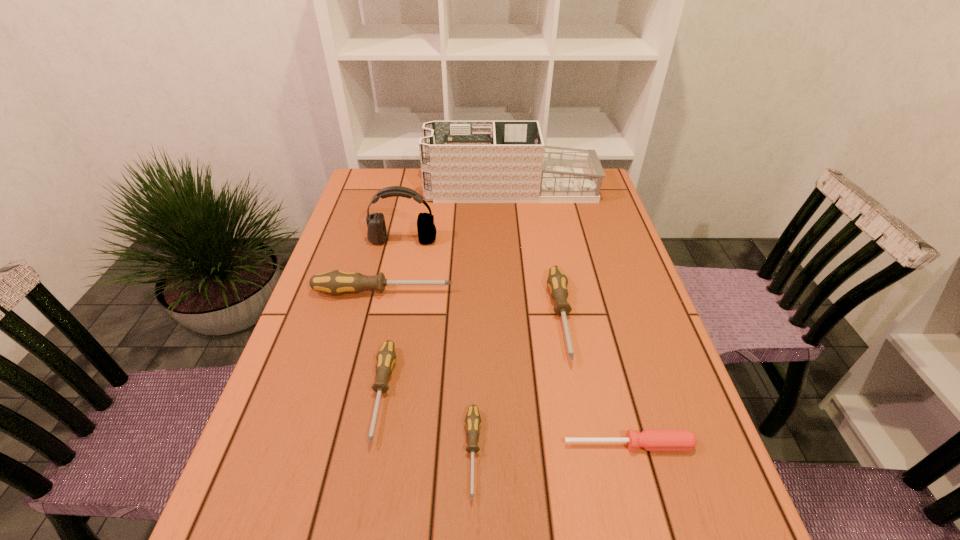
Select which gray screwdriver is the third closest to the red screwdriver. Please provide its 2D coordinates. Your answer should be formatted as a tuple, i.e. [(x, y)], where the tuple contains the x and y coordinates of a point satisfying the conditions above.

[(386, 357)]

The image size is (960, 540). Identify the location of free spot that satisfies the following two spatial constraints: 1. at the tip of the fifth shortest object; 2. on the right side of the red screwdriver. (348, 444).

This screenshot has width=960, height=540. Find the location of `vacant region that satisfies the following two spatial constraints: 1. at the tip of the red screwdriver; 2. on the right side of the tallest screwdriver`. vacant region that satisfies the following two spatial constraints: 1. at the tip of the red screwdriver; 2. on the right side of the tallest screwdriver is located at coordinates (348, 444).

At what (x,y) coordinates should I click in order to perform the action: click on vacant space that satisfies the following two spatial constraints: 1. at the tip of the red screwdriver; 2. on the right side of the third biggest gray screwdriver. Please return your answer as a coordinate pair (x, y). The height and width of the screenshot is (540, 960). Looking at the image, I should click on (372, 444).

Where is `vacant area that satisfies the following two spatial constraints: 1. at the entrance of the red screwdriver; 2. on the right side of the farthest object`? This screenshot has height=540, width=960. vacant area that satisfies the following two spatial constraints: 1. at the entrance of the red screwdriver; 2. on the right side of the farthest object is located at coordinates (536, 444).

Where is `free space that satisfies the following two spatial constraints: 1. on the headband of the second farthest object; 2. at the tip of the biggest gray screwdriver`? The height and width of the screenshot is (540, 960). free space that satisfies the following two spatial constraints: 1. on the headband of the second farthest object; 2. at the tip of the biggest gray screwdriver is located at coordinates (393, 292).

Where is `free space that satisfies the following two spatial constraints: 1. on the headband of the headset; 2. on the right side of the red screwdriver`? The image size is (960, 540). free space that satisfies the following two spatial constraints: 1. on the headband of the headset; 2. on the right side of the red screwdriver is located at coordinates (360, 444).

Where is `vacant area that satisfies the following two spatial constraints: 1. at the entrance of the farthest object; 2. on the headband of the headset`? Image resolution: width=960 pixels, height=540 pixels. vacant area that satisfies the following two spatial constraints: 1. at the entrance of the farthest object; 2. on the headband of the headset is located at coordinates (516, 240).